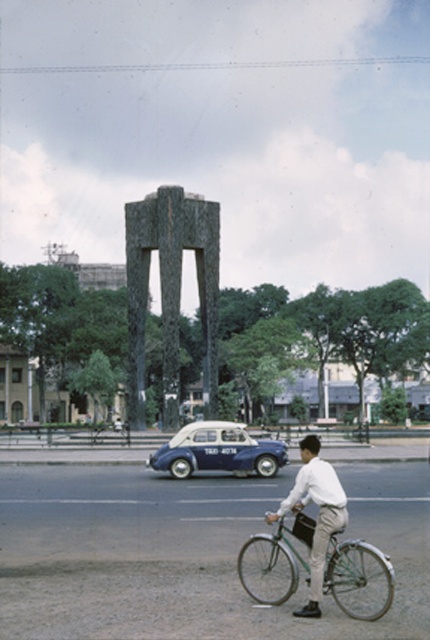
Looking at this image, you are a pedestrian standing at the crosswalk and see a green matte bicycle at center and a white matte taxi at center. Which one is nearer to you?

The green matte bicycle at center is closer to the viewer than the white matte taxi at center.

You are a pedestrian standing at the edge of the road and see both the green matte bicycle at center and the white matte taxi at center. Which one can you see the top of more easily?

The green matte bicycle at center has a lesser height compared to the white matte taxi at center, so you can see the top of the green matte bicycle at center more easily.